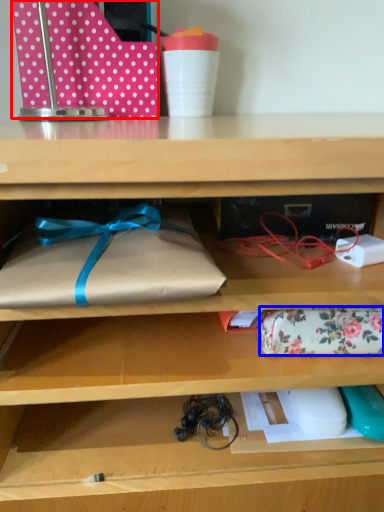
Question: Which object is further to the camera taking this photo, wrapping paper (highlighted by a red box) or wrap (highlighted by a blue box)?

Choices:
 (A) wrapping paper
 (B) wrap

Answer: (A)